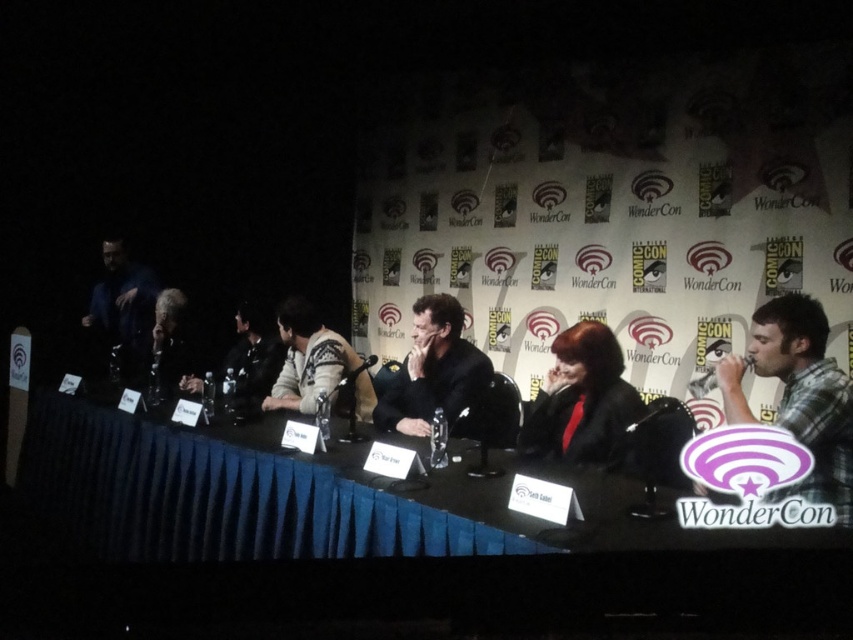
Question: Does blue fabric table at center have a larger size compared to plaid shirt at right?

Choices:
 (A) no
 (B) yes

Answer: (B)

Question: Does sweater at center appear on the left side of dark gray fabric at center?

Choices:
 (A) no
 (B) yes

Answer: (A)

Question: Which of these objects is positioned farthest from the plaid shirt at right?

Choices:
 (A) black leather jacket at center
 (B) blue fabric table at center

Answer: (B)

Question: Does blue fabric table at center have a smaller size compared to black leather jacket at center?

Choices:
 (A) no
 (B) yes

Answer: (A)

Question: Which object is positioned closest to the dark gray fabric at center?

Choices:
 (A) blue fabric table at center
 (B) black leather jacket at center
 (C) plaid shirt at right
 (D) matte black jacket at center

Answer: (A)

Question: Which point is closer to the camera?

Choices:
 (A) (335, 516)
 (B) (624, 424)

Answer: (A)